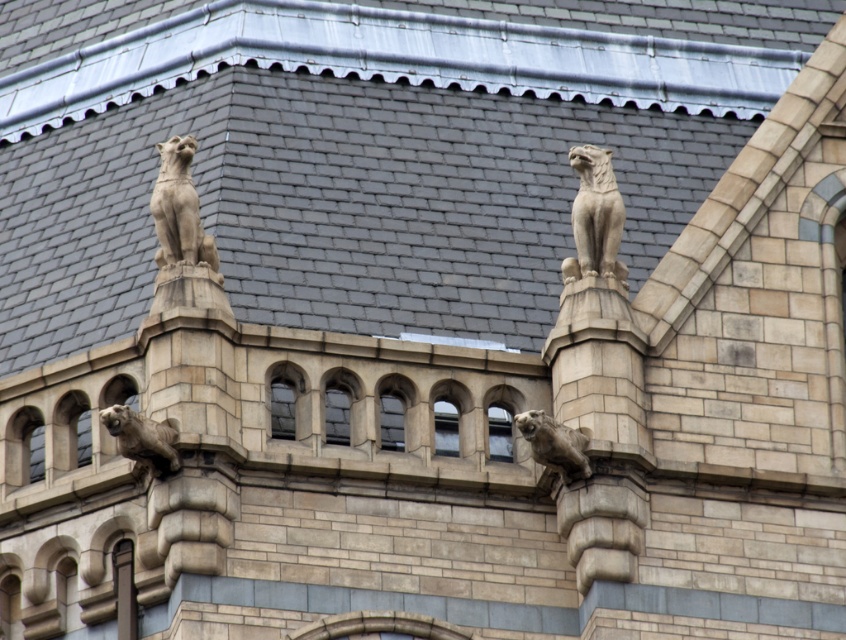
You are an architect inspecting the building facade. You notice the matte stone cat at upper left and the matte stone gargoyle at center. Which of these two figures is positioned higher up on the building?

The matte stone cat at upper left is positioned higher up on the building than the matte stone gargoyle at center because it is located above it.